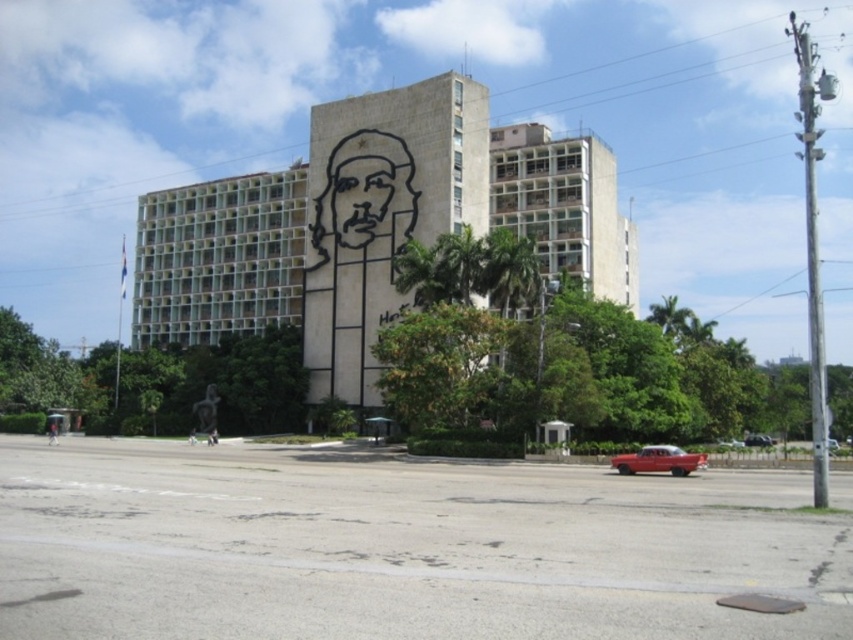
Which is in front, point (131, 328) or point (664, 460)?

Point (664, 460) is in front.

Is point (305, 244) closer to camera compared to point (627, 467)?

No.

This screenshot has height=640, width=853. I want to click on beige stone building at center, so click(x=376, y=228).

Who is more forward, (758, 436) or (837, 444)?

Point (837, 444)

Which is in front, point (747, 436) or point (825, 438)?

Point (825, 438) is more forward.

The height and width of the screenshot is (640, 853). I want to click on shiny red car at center, so click(x=758, y=440).

Who is lower down, shiny red car at lower center or shiny red car at lower right?

shiny red car at lower right

Between point (613, 460) and point (732, 444), which one is positioned in front?

Point (613, 460) is in front.

You are a GUI agent. You are given a task and a screenshot of the screen. Output one action in this format:
    pyautogui.click(x=<x>, y=<y>)
    Task: Click on the shiny red car at lower center
    The width and height of the screenshot is (853, 640).
    Given the screenshot: What is the action you would take?
    pyautogui.click(x=659, y=460)